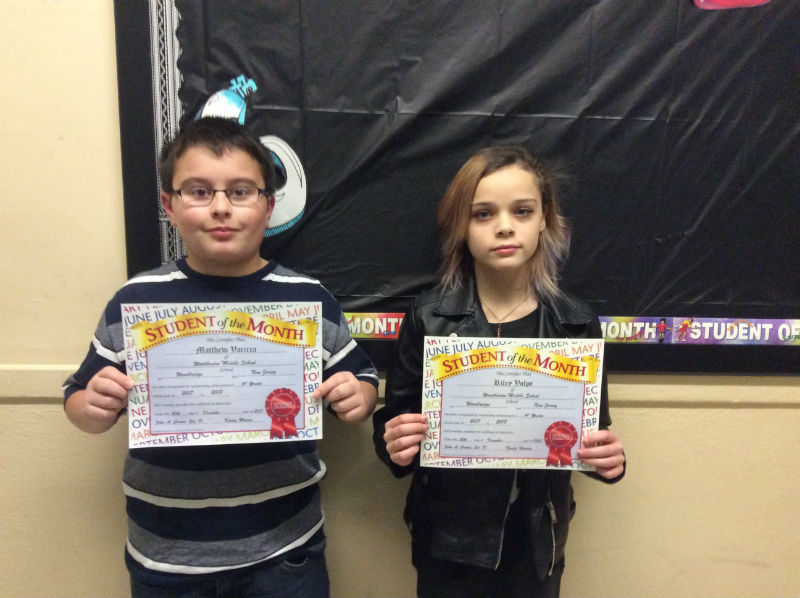
In order to click on wall in this screenshot , I will do `click(574, 515)`.